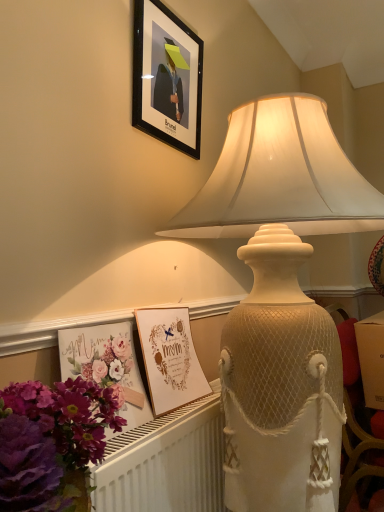
Describe the element at coordinates (52, 442) in the screenshot. I see `purple floral bouquet at lower left` at that location.

Locate an element on the screen. This screenshot has width=384, height=512. black matte picture frame at upper center is located at coordinates (167, 77).

The width and height of the screenshot is (384, 512). Describe the element at coordinates (280, 177) in the screenshot. I see `matte cream lampshade at upper center` at that location.

Find the location of a particular element. This screenshot has height=512, width=384. purple floral bouquet at lower left is located at coordinates (52, 442).

Can floral paper postcard at lower left, which ranks as the 1th postcard in front-to-back order, be found inside matte gold postcard at lower center, arranged as the 2th postcard when viewed from the front?

Definitely not — floral paper postcard at lower left, which ranks as the 1th postcard in front-to-back order, is not inside matte gold postcard at lower center, arranged as the 2th postcard when viewed from the front.

From the image's perspective, is matte gold postcard at lower center, which is counted as the 1th postcard, starting from the back, located above floral paper postcard at lower left, which ranks as the 1th postcard in front-to-back order?

Yes, from the image's perspective, matte gold postcard at lower center, which is counted as the 1th postcard, starting from the back, is on top of floral paper postcard at lower left, which ranks as the 1th postcard in front-to-back order.

How many degrees apart are the facing directions of matte gold postcard at lower center, arranged as the 2th postcard when viewed from the front, and floral paper postcard at lower left, which ranks as the 1th postcard in front-to-back order?

The angular difference between matte gold postcard at lower center, arranged as the 2th postcard when viewed from the front, and floral paper postcard at lower left, which ranks as the 1th postcard in front-to-back order, is 0.011 degrees.

Considering the positions of points (159, 320) and (85, 362), is point (159, 320) farther from camera compared to point (85, 362)?

That is True.

From the image's perspective, is matte cream lampshade at upper center under matte gold postcard at lower center, arranged as the 2th postcard when viewed from the front?

No, from the image's perspective, matte cream lampshade at upper center is not below matte gold postcard at lower center, arranged as the 2th postcard when viewed from the front.

Based on the photo, which is in front, matte cream lampshade at upper center or matte gold postcard at lower center, arranged as the 2th postcard when viewed from the front?

Positioned in front is matte cream lampshade at upper center.

Considering the positions of points (377, 195) and (185, 361), is point (377, 195) farther from camera compared to point (185, 361)?

No, it is not.

Who is taller, matte gold postcard at lower center, which is counted as the 1th postcard, starting from the back, or matte cream lampshade at upper center?

With more height is matte cream lampshade at upper center.

Is matte gold postcard at lower center, arranged as the 2th postcard when viewed from the front, looking in the opposite direction of matte cream lampshade at upper center?

That's right, matte gold postcard at lower center, arranged as the 2th postcard when viewed from the front, is facing away from matte cream lampshade at upper center.

Would you say matte gold postcard at lower center, arranged as the 2th postcard when viewed from the front, is to the left or to the right of matte cream lampshade at upper center in the picture?

Clearly, matte gold postcard at lower center, arranged as the 2th postcard when viewed from the front, is on the left of matte cream lampshade at upper center in the image.

Which object is thinner, white textured radiator at lower left or matte cream lampshade at upper center?

white textured radiator at lower left.

From a real-world perspective, relative to matte cream lampshade at upper center, is white textured radiator at lower left vertically above or below?

From a real-world perspective, white textured radiator at lower left is physically below matte cream lampshade at upper center.

Considering the positions of objects white textured radiator at lower left and matte cream lampshade at upper center in the image provided, who is in front, white textured radiator at lower left or matte cream lampshade at upper center?

matte cream lampshade at upper center is closer to the camera.

Identify the location of radiator that appears below the matte cream lampshade at upper center (from the image's perspective). (166, 462).

Which object is further away from the camera, white textured radiator at lower left or purple floral bouquet at lower left?

white textured radiator at lower left is behind.

Which is more to the right, white textured radiator at lower left or purple floral bouquet at lower left?

white textured radiator at lower left.

Which of these two, white textured radiator at lower left or purple floral bouquet at lower left, stands taller?

Standing taller between the two is white textured radiator at lower left.

Based on the photo, could you tell me if white textured radiator at lower left is turned towards purple floral bouquet at lower left?

No, white textured radiator at lower left is not turned towards purple floral bouquet at lower left.

Find the location of a particular element. the 2nd postcard behind the white textured radiator at lower left, starting your count from the anchor is located at coordinates (169, 358).

Can we say white textured radiator at lower left lies outside matte gold postcard at lower center, arranged as the 2th postcard when viewed from the front?

white textured radiator at lower left is positioned outside matte gold postcard at lower center, arranged as the 2th postcard when viewed from the front.

Identify the location of flower below the floral paper postcard at lower left, placed as the 2th postcard when sorted from back to front (from a real-world perspective). The image size is (384, 512). (52, 442).

Would you say floral paper postcard at lower left, which ranks as the 1th postcard in front-to-back order, is outside purple floral bouquet at lower left?

Yes, floral paper postcard at lower left, which ranks as the 1th postcard in front-to-back order, is located beyond the bounds of purple floral bouquet at lower left.

Which of these two, floral paper postcard at lower left, which ranks as the 1th postcard in front-to-back order, or purple floral bouquet at lower left, is smaller?

With smaller size is floral paper postcard at lower left, which ranks as the 1th postcard in front-to-back order.

How far apart are floral paper postcard at lower left, which ranks as the 1th postcard in front-to-back order, and purple floral bouquet at lower left?

floral paper postcard at lower left, which ranks as the 1th postcard in front-to-back order, and purple floral bouquet at lower left are 18.65 centimeters apart.

Where is `postcard above the floral paper postcard at lower left, placed as the 2th postcard when sorted from back to front (from a real-world perspective)`? postcard above the floral paper postcard at lower left, placed as the 2th postcard when sorted from back to front (from a real-world perspective) is located at coordinates (169, 358).

The height and width of the screenshot is (512, 384). What are the coordinates of `postcard that is the 1st one below the matte cream lampshade at upper center (from a real-world perspective)` in the screenshot? It's located at (169, 358).

Based on their spatial positions, is white textured radiator at lower left or matte gold postcard at lower center, arranged as the 2th postcard when viewed from the front, further from floral paper postcard at lower left, which ranks as the 1th postcard in front-to-back order?

Among the two, white textured radiator at lower left is located further to floral paper postcard at lower left, which ranks as the 1th postcard in front-to-back order.

Considering their positions, is matte gold postcard at lower center, arranged as the 2th postcard when viewed from the front, positioned further to black matte picture frame at upper center than matte cream lampshade at upper center?

matte gold postcard at lower center, arranged as the 2th postcard when viewed from the front, is positioned further to the anchor black matte picture frame at upper center.

Based on their spatial positions, is black matte picture frame at upper center or matte cream lampshade at upper center closer to white textured radiator at lower left?

matte cream lampshade at upper center.

Looking at this image, from the image, which object appears to be farther from white textured radiator at lower left, matte gold postcard at lower center, arranged as the 2th postcard when viewed from the front, or matte cream lampshade at upper center?

Among the two, matte cream lampshade at upper center is located further to white textured radiator at lower left.

Considering their positions, is purple floral bouquet at lower left positioned closer to floral paper postcard at lower left, placed as the 2th postcard when sorted from back to front, than black matte picture frame at upper center?

Based on the image, purple floral bouquet at lower left appears to be nearer to floral paper postcard at lower left, placed as the 2th postcard when sorted from back to front.

From the image, which object appears to be nearer to matte gold postcard at lower center, which is counted as the 1th postcard, starting from the back, matte cream lampshade at upper center or purple floral bouquet at lower left?

matte cream lampshade at upper center is positioned closer to the anchor matte gold postcard at lower center, which is counted as the 1th postcard, starting from the back.

Considering their positions, is floral paper postcard at lower left, which ranks as the 1th postcard in front-to-back order, positioned closer to purple floral bouquet at lower left than matte gold postcard at lower center, which is counted as the 1th postcard, starting from the back?

The object closer to purple floral bouquet at lower left is floral paper postcard at lower left, which ranks as the 1th postcard in front-to-back order.

From the image, which object appears to be nearer to black matte picture frame at upper center, floral paper postcard at lower left, placed as the 2th postcard when sorted from back to front, or white textured radiator at lower left?

floral paper postcard at lower left, placed as the 2th postcard when sorted from back to front, lies closer to black matte picture frame at upper center than the other object.

Find the location of `radiator between purple floral bouquet at lower left and matte gold postcard at lower center, which is counted as the 1th postcard, starting from the back, from front to back`. radiator between purple floral bouquet at lower left and matte gold postcard at lower center, which is counted as the 1th postcard, starting from the back, from front to back is located at coordinates (166, 462).

Locate an element on the screen. This screenshot has height=512, width=384. lamp between black matte picture frame at upper center and purple floral bouquet at lower left from top to bottom is located at coordinates (280, 177).

Identify the location of lamp between purple floral bouquet at lower left and matte gold postcard at lower center, arranged as the 2th postcard when viewed from the front, along the z-axis. (280, 177).

Find the location of a particular element. lamp that lies between black matte picture frame at upper center and matte gold postcard at lower center, arranged as the 2th postcard when viewed from the front, from top to bottom is located at coordinates (280, 177).